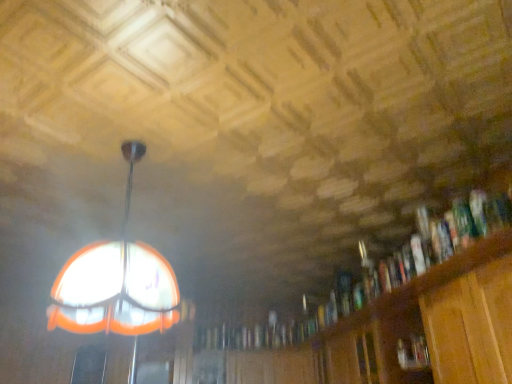
Where is `translucent glass dome at upper left`? The height and width of the screenshot is (384, 512). translucent glass dome at upper left is located at coordinates (116, 284).

Measure the distance between point (x=416, y=339) and camera.

A distance of 7.38 feet exists between point (x=416, y=339) and camera.

This screenshot has width=512, height=384. Identify the location of translucent glass dome at upper left. (116, 284).

Which is more to the left, translucent glass dome at upper left or wooden bookcase at right?

Positioned to the left is translucent glass dome at upper left.

Would you say wooden bookcase at right is part of translucent glass dome at upper left's contents?

No.

Is point (152, 280) closer or farther from the camera than point (461, 211)?

Point (152, 280) appears to be closer to the viewer than point (461, 211).

This screenshot has height=384, width=512. What are the coordinates of `bookcase that is on the right side of translucent glass dome at upper left` in the screenshot? It's located at (392, 320).

Is hardcover book at right completely or partially inside wooden bookcase at right?

Yes, hardcover book at right is a part of wooden bookcase at right.

From a real-world perspective, between wooden bookcase at right and hardcover book at right, who is vertically lower?

From a 3D spatial view, hardcover book at right is below.

Considering the relative sizes of wooden bookcase at right and hardcover book at right in the image provided, is wooden bookcase at right smaller than hardcover book at right?

Actually, wooden bookcase at right might be larger than hardcover book at right.

Is wooden bookcase at right facing away from hardcover book at right?

Yes, wooden bookcase at right's orientation is away from hardcover book at right.

Considering the positions of objects translucent glass dome at upper left and hardcover book at right in the image provided, who is more to the right, translucent glass dome at upper left or hardcover book at right?

hardcover book at right is more to the right.

Can we say translucent glass dome at upper left lies outside hardcover book at right?

Yes, translucent glass dome at upper left is not within hardcover book at right.

Can you confirm if translucent glass dome at upper left is thinner than hardcover book at right?

No, translucent glass dome at upper left is not thinner than hardcover book at right.

From a real-world perspective, which object rests below the other?

hardcover book at right is physically lower.

From the picture: Which object is positioned more to the left, wooden bookcase at right or wooden cabinet at lower right?

Positioned to the left is wooden cabinet at lower right.

Based on the photo, from the image's perspective, does wooden bookcase at right appear higher than wooden cabinet at lower right?

Yes, from the image's perspective, wooden bookcase at right is above wooden cabinet at lower right.

Does wooden bookcase at right turn towards wooden cabinet at lower right?

No, wooden bookcase at right is not aimed at wooden cabinet at lower right.

Is wooden bookcase at right far from wooden cabinet at lower right?

No, there isn't a large distance between wooden bookcase at right and wooden cabinet at lower right.

Which is correct: hardcover book at right is inside translucent glass dome at upper left, or outside of it?

The correct answer is: outside.

From the picture: Can you confirm if hardcover book at right is wider than translucent glass dome at upper left?

No.

Can you see hardcover book at right touching translucent glass dome at upper left?

No, hardcover book at right is not with translucent glass dome at upper left.

Choose the correct answer: Is translucent glass dome at upper left inside wooden cabinet at lower right or outside it?

translucent glass dome at upper left is not inside wooden cabinet at lower right, it's outside.

Based on the photo, based on their sizes in the image, would you say translucent glass dome at upper left is bigger or smaller than wooden cabinet at lower right?

Clearly, translucent glass dome at upper left is larger in size than wooden cabinet at lower right.

Which of these two, translucent glass dome at upper left or wooden cabinet at lower right, stands taller?

translucent glass dome at upper left.

Could you tell me if translucent glass dome at upper left is turned towards wooden cabinet at lower right?

No.

Is hardcover book at right far away from wooden bookcase at right?

They are positioned close to each other.

Which object is further away from the camera, hardcover book at right or wooden bookcase at right?

hardcover book at right is behind.

From a real-world perspective, is hardcover book at right physically above wooden bookcase at right?

No, from a real-world perspective, hardcover book at right is not over wooden bookcase at right

Considering the relative sizes of hardcover book at right and wooden bookcase at right in the image provided, is hardcover book at right thinner than wooden bookcase at right?

Indeed, hardcover book at right has a lesser width compared to wooden bookcase at right.

This screenshot has width=512, height=384. Identify the location of lamp above the wooden bookcase at right (from a real-world perspective). (116, 284).

Identify the location of book below the wooden bookcase at right (from a real-world perspective). (413, 352).

When comparing their distances from translucent glass dome at upper left, does wooden cabinet at lower right or wooden bookcase at right seem further?

Based on the image, wooden cabinet at lower right appears to be further to translucent glass dome at upper left.

Based on their spatial positions, is hardcover book at right or wooden cabinet at lower right further from translucent glass dome at upper left?

wooden cabinet at lower right is positioned further to the anchor translucent glass dome at upper left.

Which object lies further to the anchor point wooden bookcase at right, hardcover book at right or translucent glass dome at upper left?

Based on the image, translucent glass dome at upper left appears to be further to wooden bookcase at right.

Estimate the real-world distances between objects in this image. Which object is further from wooden cabinet at lower right, wooden bookcase at right or hardcover book at right?

hardcover book at right.

Looking at the image, which one is located closer to hardcover book at right, wooden bookcase at right or wooden cabinet at lower right?

wooden bookcase at right.

Considering their positions, is wooden bookcase at right positioned further to hardcover book at right than translucent glass dome at upper left?

translucent glass dome at upper left lies further to hardcover book at right than the other object.

When comparing their distances from wooden bookcase at right, does hardcover book at right or wooden cabinet at lower right seem closer?

Based on the image, wooden cabinet at lower right appears to be nearer to wooden bookcase at right.

From the image, which object appears to be farther from translucent glass dome at upper left, wooden bookcase at right or wooden cabinet at lower right?

The object further to translucent glass dome at upper left is wooden cabinet at lower right.

I want to click on book between translucent glass dome at upper left and wooden cabinet at lower right along the z-axis, so click(x=413, y=352).

The width and height of the screenshot is (512, 384). What are the coordinates of `lamp located between wooden bookcase at right and wooden cabinet at lower right in the depth direction` in the screenshot? It's located at [x=116, y=284].

Locate an element on the screen. book between wooden bookcase at right and wooden cabinet at lower right in the front-back direction is located at coordinates (413, 352).

Image resolution: width=512 pixels, height=384 pixels. What are the coordinates of `bookcase between translucent glass dome at upper left and hardcover book at right` in the screenshot? It's located at (392, 320).